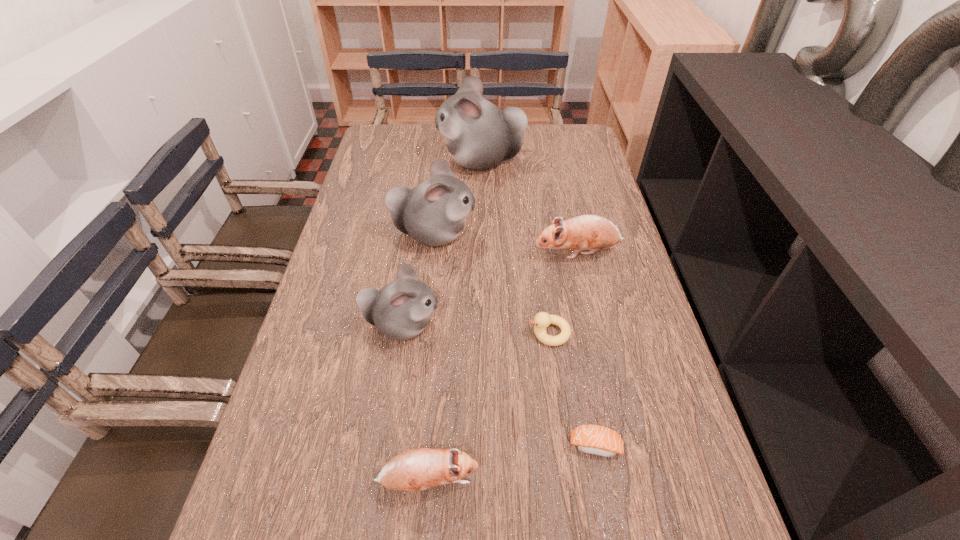
In the image, there is a desktop. Identify the location of free space at the right edge. (596, 326).

Where is `free spot at the far left corner of the desktop`? free spot at the far left corner of the desktop is located at coordinates (411, 138).

I want to click on free space at the far right corner of the desktop, so click(x=554, y=154).

Where is `unoccupied position between the shortest object and the farther brown hamster`? Image resolution: width=960 pixels, height=540 pixels. unoccupied position between the shortest object and the farther brown hamster is located at coordinates (587, 349).

The image size is (960, 540). In order to click on vacant area that lies between the farthest white hamster and the nearest hamster in this screenshot , I will do `click(454, 321)`.

Locate an element on the screen. The height and width of the screenshot is (540, 960). vacant area that lies between the orange sushi and the nearest object is located at coordinates (512, 463).

Locate an element on the screen. Image resolution: width=960 pixels, height=540 pixels. vacant area that lies between the fourth shortest hamster and the duckling is located at coordinates (492, 284).

The width and height of the screenshot is (960, 540). I want to click on free space between the right brown hamster and the nearest object, so click(503, 367).

Find the location of `free space between the second tallest object and the farther brown hamster`. free space between the second tallest object and the farther brown hamster is located at coordinates (506, 244).

Locate an element on the screen. The height and width of the screenshot is (540, 960). free point between the fourth farthest hamster and the sixth tallest object is located at coordinates (475, 329).